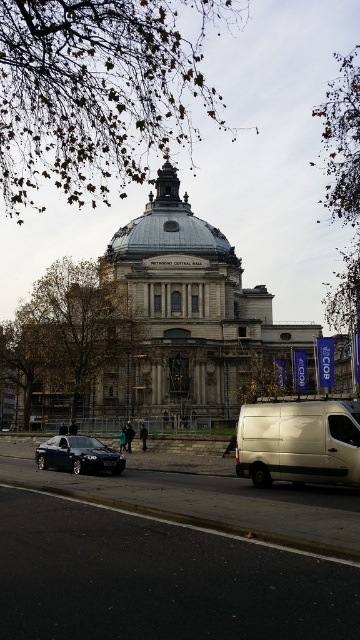
You are standing at the entrance of Methodist Central Hall and want to hail a taxi. You see a silver metallic van at lower right. Is the van positioned to the left or right of the building?

The silver metallic van at lower right is located at point (299, 442), which places it to the right side of the building relative to the entrance.

You are a delivery driver who needs to park your vehicle between the silver metallic van at lower right and the shiny black sedan at lower left. The parking space between them is 25.52 meters long. Can your truck, which is 12 meters long, fit in that space?

The parking space between the silver metallic van at lower right and the shiny black sedan at lower left is 25.52 meters long. Since your truck is only 12 meters long, it can easily fit within that space.